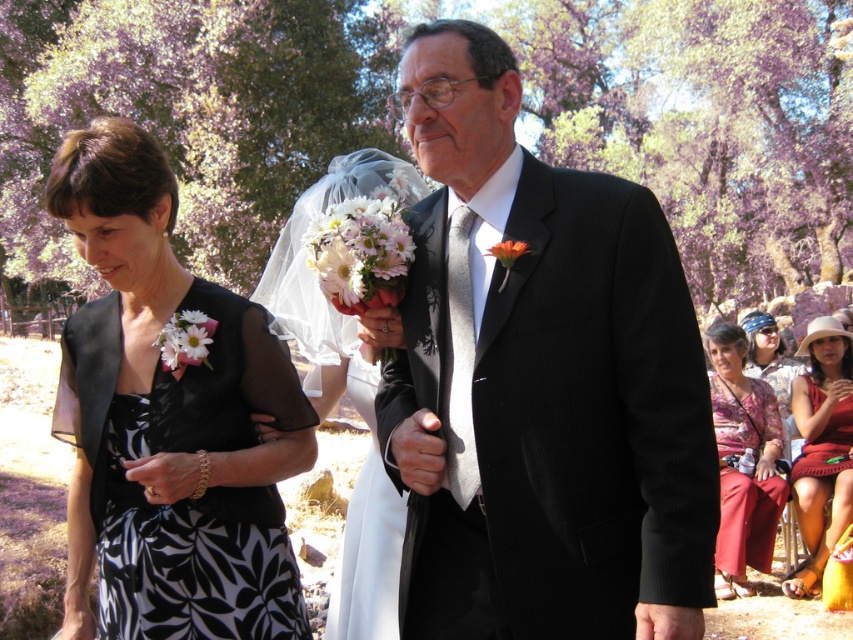
Question: Which point is farther from the camera taking this photo?

Choices:
 (A) (372, 616)
 (B) (532, 628)
 (C) (741, 528)
 (D) (345, 256)

Answer: (C)

Question: Estimate the real-world distances between objects in this image. Which object is farther from the floral print blouse at lower right?

Choices:
 (A) white matte bouquet at center
 (B) black and white floral dress at center
 (C) white matte flower at lower left
 (D) matte red dress at lower right

Answer: (C)

Question: Does white satin veil at center have a larger size compared to white matte bouquet at center?

Choices:
 (A) no
 (B) yes

Answer: (B)

Question: Is white matte bouquet at center thinner than orange matte flower at center?

Choices:
 (A) yes
 (B) no

Answer: (B)

Question: Does white satin veil at center appear under matte red dress at lower right?

Choices:
 (A) yes
 (B) no

Answer: (B)

Question: Which of these objects is positioned farthest from the gray/satin tie at center?

Choices:
 (A) white satin veil at center
 (B) white matte flower at lower left
 (C) floral print blouse at lower right
 (D) white matte bouquet at center

Answer: (C)